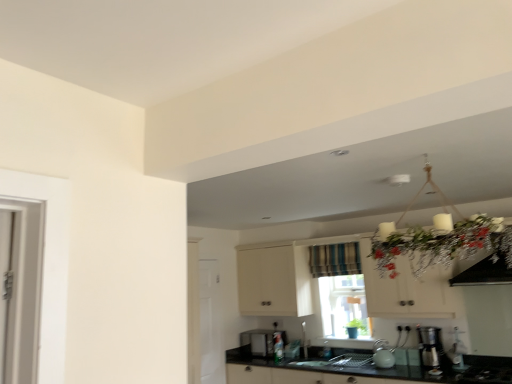
Question: Considering the positions of white glossy door at lower left and satin silver coffee machine at lower right in the image, is white glossy door at lower left taller or shorter than satin silver coffee machine at lower right?

Choices:
 (A) short
 (B) tall

Answer: (B)

Question: From a real-world perspective, is white glossy door at lower left physically located above or below satin silver coffee machine at lower right?

Choices:
 (A) below
 (B) above

Answer: (B)

Question: Which is farther from the white glossy door at lower left?

Choices:
 (A) satin nickel faucet at sink center
 (B) matte teal kettle at lower center, the second appliance when ordered from bottom to top
 (C) satin black microwave at lower center, the second appliance from the right
 (D) black granite countertop at lower center
 (E) white matte cabinet at upper center

Answer: (B)

Question: Which object is positioned farthest from the clear glass window at center?

Choices:
 (A) green matte plant at lower center
 (B) matte teal kettle at lower center, the 2th appliance from the left
 (C) black glass gas stove at lower right
 (D) striped fabric curtain at center
 (E) black granite countertop at lower center

Answer: (C)